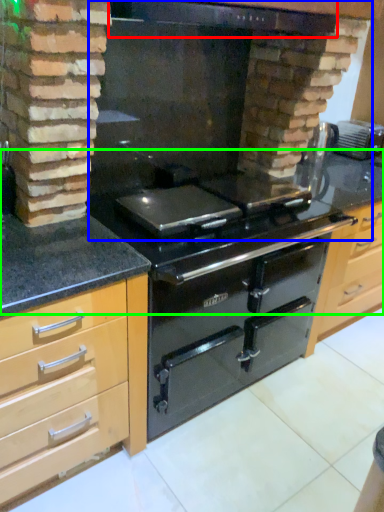
Question: Estimate the real-world distances between objects in this image. Which object is closer to exhaust hood (highlighted by a red box), fireplace (highlighted by a blue box) or counter top (highlighted by a green box)?

Choices:
 (A) fireplace
 (B) counter top

Answer: (A)